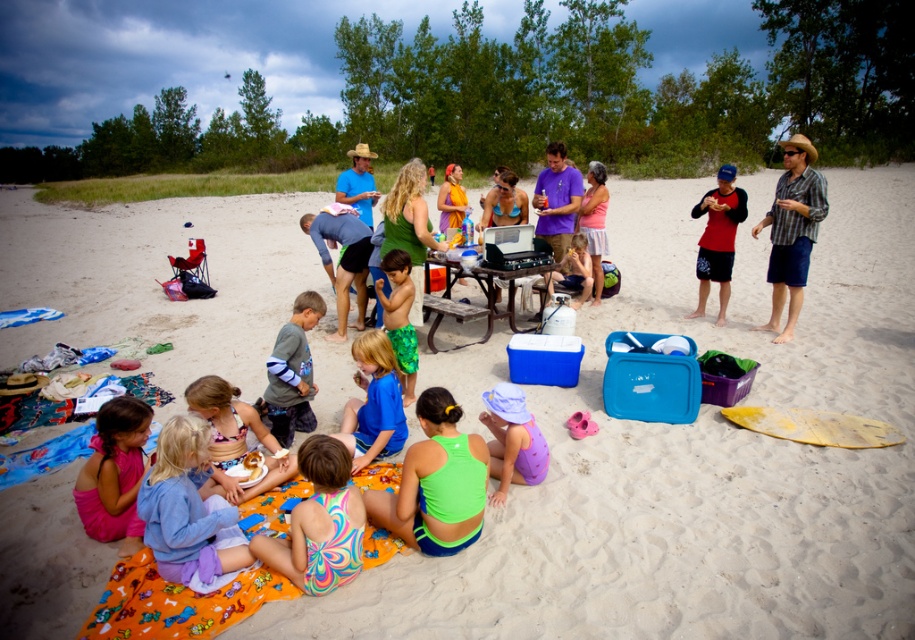
Is multicolored swimsuit at center thinner than matte red shirt at center?

No, multicolored swimsuit at center is not thinner than matte red shirt at center.

Which is more to the right, multicolored swimsuit at center or matte red shirt at center?

Positioned to the right is matte red shirt at center.

Is point (294, 552) behind point (718, 282)?

No, it is in front of (718, 282).

You are a GUI agent. You are given a task and a screenshot of the screen. Output one action in this format:
    pyautogui.click(x=<x>, y=<y>)
    Task: Click on the multicolored swimsuit at center
    The image size is (915, 640).
    Given the screenshot: What is the action you would take?
    pyautogui.click(x=320, y=522)

Does multicolored swimsuit at center have a smaller size compared to pink fabric dress at lower left?

Incorrect, multicolored swimsuit at center is not smaller in size than pink fabric dress at lower left.

Between point (324, 572) and point (122, 424), which one is positioned in front?

Point (324, 572)

Image resolution: width=915 pixels, height=640 pixels. What are the coordinates of `multicolored swimsuit at center` in the screenshot? It's located at (320, 522).

Does striped long-sleeve shirt at center have a smaller size compared to matte red shirt at center?

Yes.

The height and width of the screenshot is (640, 915). Find the location of `striped long-sleeve shirt at center`. striped long-sleeve shirt at center is located at coordinates (292, 372).